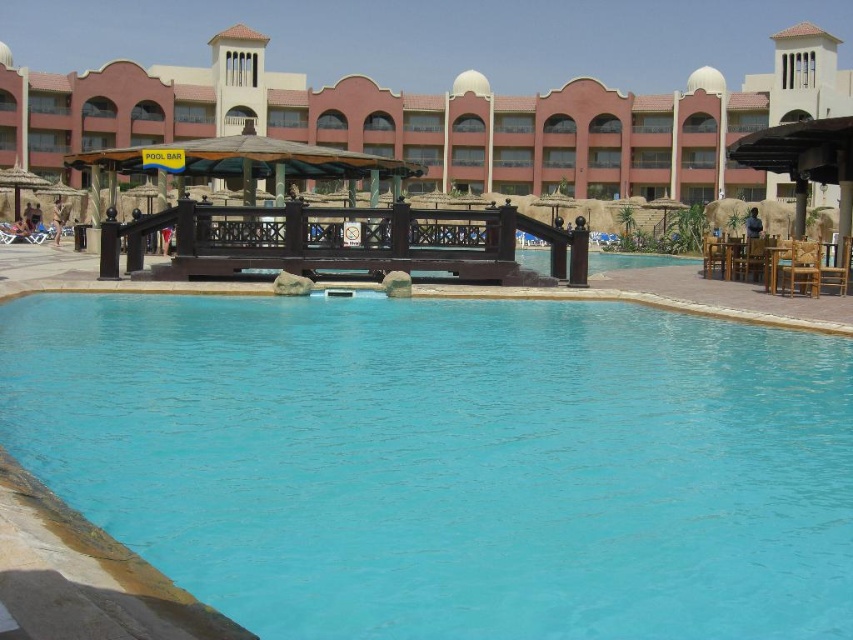
Is blue smooth water at center bigger than brown wooden gazebo at center?

No, blue smooth water at center is not bigger than brown wooden gazebo at center.

Between blue smooth water at center and brown wooden gazebo at center, which one appears on the left side from the viewer's perspective?

blue smooth water at center

Does point (305, 440) come farther from viewer compared to point (519, 124)?

No, (305, 440) is in front of (519, 124).

At what (x,y) coordinates should I click in order to perform the action: click on blue smooth water at center. Please return your answer as a coordinate pair (x, y). The height and width of the screenshot is (640, 853). Looking at the image, I should click on (450, 461).